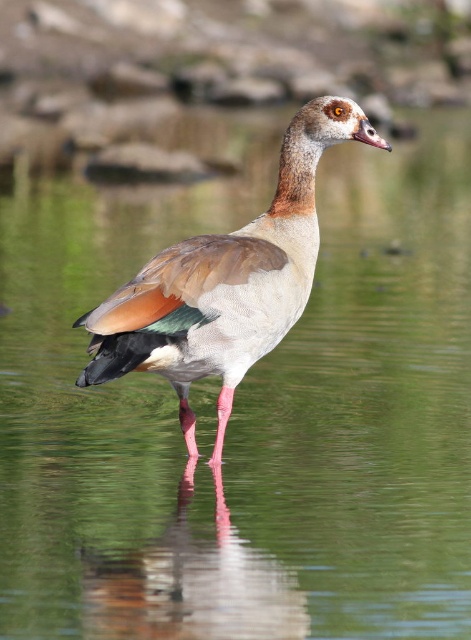
Does brown feathered goose at center have a larger size compared to glossy water at center?

Correct, brown feathered goose at center is larger in size than glossy water at center.

Is point (289, 154) positioned before point (149, 605)?

No, it is not.

You are a GUI agent. You are given a task and a screenshot of the screen. Output one action in this format:
    pyautogui.click(x=<x>, y=<y>)
    Task: Click on the brown feathered goose at center
    
    Given the screenshot: What is the action you would take?
    pyautogui.click(x=226, y=282)